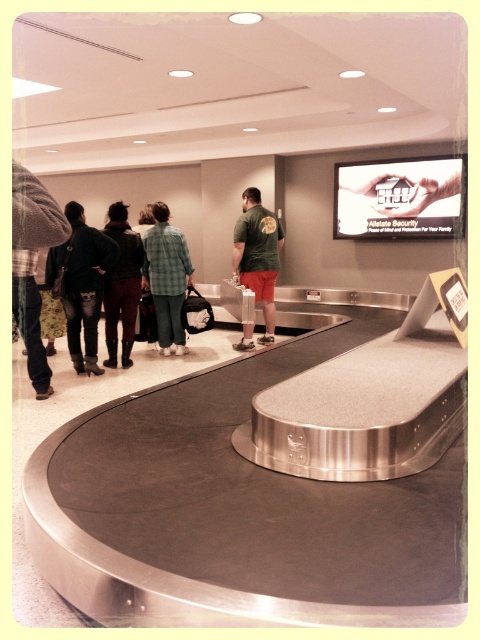
Looking at this image, you are standing in the airport baggage claim area and want to take a photo of the two points mentioned. Which point, point (85,372) or point (117,342), will appear larger in your photo?

Point (85,372) will appear larger in the photo because it is closer to the camera than point (117,342).